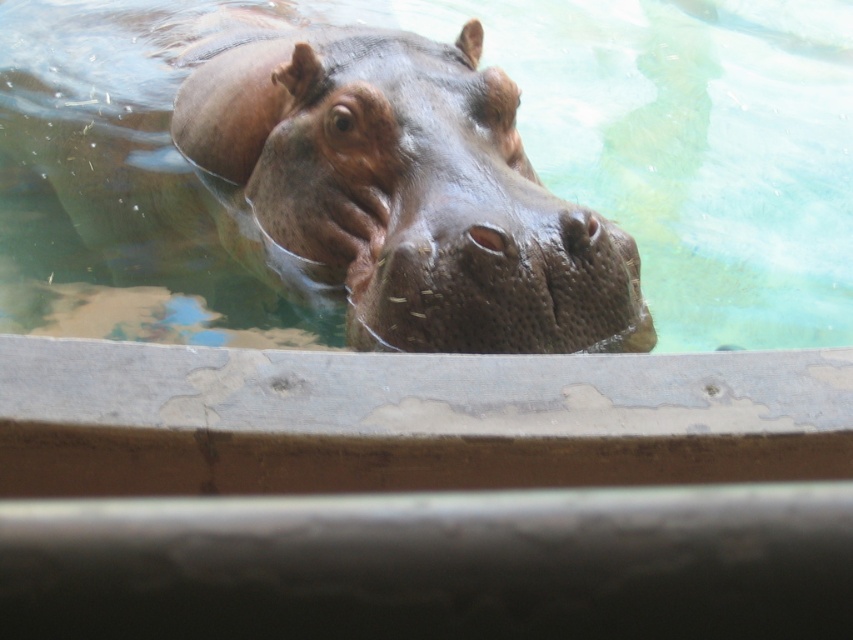
Question: Which point is farther to the camera?

Choices:
 (A) smooth concrete pool at center
 (B) brown rough skin at center

Answer: (A)

Question: Can you confirm if smooth concrete pool at center is positioned above sandy brown textured nose at center?

Choices:
 (A) no
 (B) yes

Answer: (B)

Question: Does brown rough skin at center appear under sandy brown textured nose at center?

Choices:
 (A) yes
 (B) no

Answer: (B)

Question: Which point is closer to the camera?

Choices:
 (A) (96, 260)
 (B) (567, 221)

Answer: (B)

Question: Which point appears closest to the camera in this image?

Choices:
 (A) (692, 337)
 (B) (578, 243)
 (C) (335, 225)

Answer: (B)

Question: Can you confirm if brown rough skin at center is positioned below sandy brown textured nose at center?

Choices:
 (A) yes
 (B) no

Answer: (B)